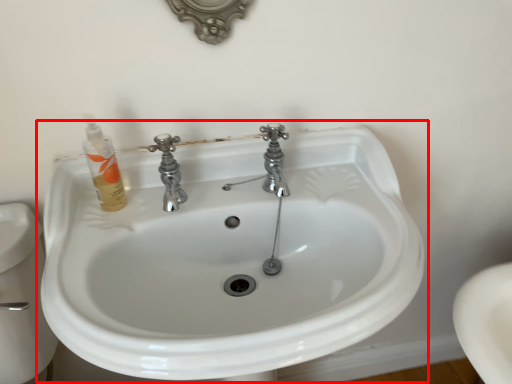
Question: From the image's perspective, what is the correct spatial positioning of sink (annotated by the red box) in reference to toiletry?

Choices:
 (A) above
 (B) below

Answer: (B)